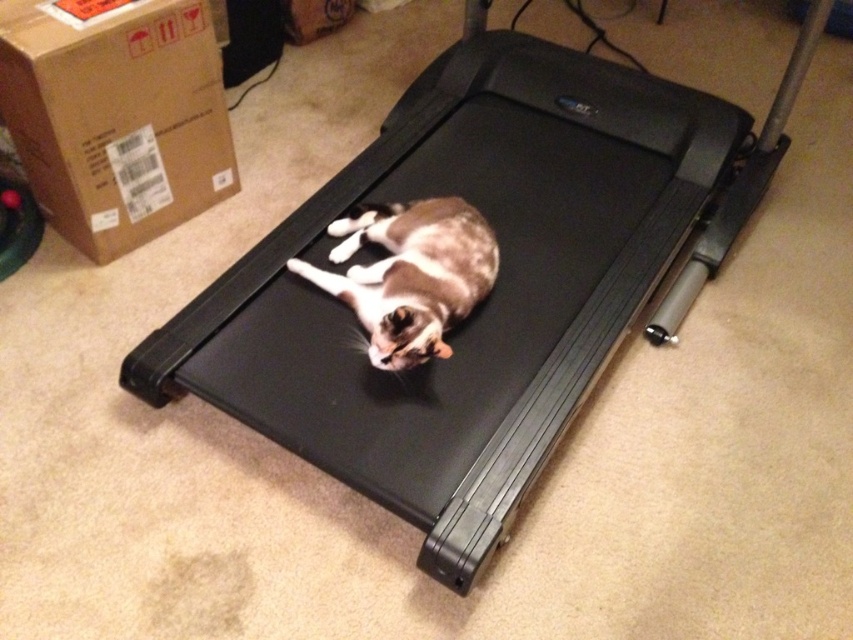
You are a delivery person who just arrived at the house. You see a brown cardboard box at upper left and a brown and white fur cat at center. Which object is closer to you?

The brown cardboard box at upper left is closer to you because the brown and white fur cat at center is behind it.

You are a delivery person who just arrived at the house. You need to place a new package that is 5 feet long on the floor. Looking at the scene, is there enough space between you and the brown cardboard box at upper left to place the package without moving anything?

The distance between the brown cardboard box at upper left and the viewer is 4.85 feet. Since the package is 5 feet long, it would not fit in the available space.

You are moving into a new apartment and need to transport both the brown cardboard box at upper left and the brown and white fur cat at center. The elevator has a width of 1 meter. Can both items fit side by side in the elevator?

The brown cardboard box at upper left might be wider than brown and white fur cat at center, so it is uncertain if both will fit. You should check the exact dimensions of the box and the cat to ensure they can fit within the 1 meter width.